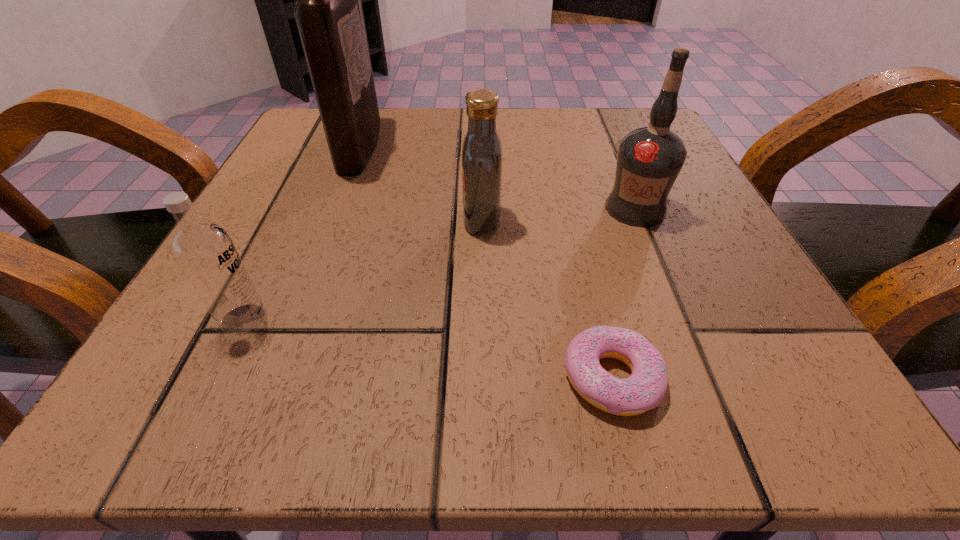
You are a GUI agent. You are given a task and a screenshot of the screen. Output one action in this format:
    pyautogui.click(x=<x>, y=<y>)
    Task: Click on the object situated at the right edge
    
    Given the screenshot: What is the action you would take?
    pyautogui.click(x=649, y=159)

What are the coordinates of `object that is at the far left corner` in the screenshot? It's located at (328, 11).

The image size is (960, 540). What are the coordinates of `free location at the far edge` in the screenshot? It's located at (411, 111).

At what (x,y) coordinates should I click in order to perform the action: click on free space at the near edge of the desktop. Please return your answer as a coordinate pair (x, y). The height and width of the screenshot is (540, 960). Looking at the image, I should click on (299, 376).

The width and height of the screenshot is (960, 540). In the image, there is a desktop. Identify the location of vacant space at the left edge. (331, 192).

At what (x,y) coordinates should I click in order to perform the action: click on free region at the right edge. Please return your answer as a coordinate pair (x, y). Looking at the image, I should click on (649, 246).

This screenshot has height=540, width=960. In order to click on vacant space at the far left corner in this screenshot , I will do `click(321, 162)`.

In the image, there is a desktop. Identify the location of vacant region at the far right corner. (592, 125).

The height and width of the screenshot is (540, 960). What are the coordinates of `vacant space at the near right corner of the desktop` in the screenshot? It's located at [x=811, y=391].

Image resolution: width=960 pixels, height=540 pixels. What are the coordinates of `vacant space in between the fourth farthest object and the tallest object` in the screenshot? It's located at (301, 233).